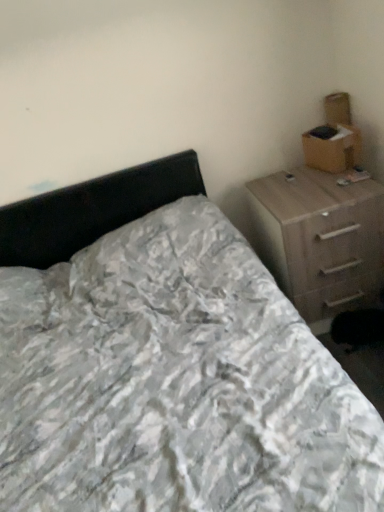
Question: Does white textured bed at center turn towards light brown wood chest of drawers at right?

Choices:
 (A) no
 (B) yes

Answer: (A)

Question: Can you confirm if white textured bed at center is thinner than light brown wood chest of drawers at right?

Choices:
 (A) no
 (B) yes

Answer: (A)

Question: Is white textured bed at center shorter than light brown wood chest of drawers at right?

Choices:
 (A) no
 (B) yes

Answer: (A)

Question: Considering the relative sizes of white textured bed at center and light brown wood chest of drawers at right in the image provided, is white textured bed at center smaller than light brown wood chest of drawers at right?

Choices:
 (A) no
 (B) yes

Answer: (A)

Question: Is light brown wood chest of drawers at right inside white textured bed at center?

Choices:
 (A) yes
 (B) no

Answer: (B)

Question: Would you say white textured bed at center is inside or outside brown cardboard box at upper right?

Choices:
 (A) outside
 (B) inside

Answer: (A)

Question: From the image's perspective, relative to brown cardboard box at upper right, is white textured bed at center above or below?

Choices:
 (A) above
 (B) below

Answer: (B)

Question: Considering the relative positions of white textured bed at center and brown cardboard box at upper right in the image provided, is white textured bed at center to the left or to the right of brown cardboard box at upper right?

Choices:
 (A) left
 (B) right

Answer: (A)

Question: From a real-world perspective, relative to brown cardboard box at upper right, is white textured bed at center vertically above or below?

Choices:
 (A) above
 (B) below

Answer: (B)

Question: From a real-world perspective, is white textured bed at center above or below light brown wood chest of drawers at right?

Choices:
 (A) above
 (B) below

Answer: (A)

Question: Visually, is white textured bed at center positioned to the left or to the right of light brown wood chest of drawers at right?

Choices:
 (A) left
 (B) right

Answer: (A)

Question: Based on their sizes in the image, would you say white textured bed at center is bigger or smaller than light brown wood chest of drawers at right?

Choices:
 (A) big
 (B) small

Answer: (A)

Question: From the image's perspective, is white textured bed at center located above or below light brown wood chest of drawers at right?

Choices:
 (A) above
 (B) below

Answer: (B)

Question: Based on their sizes in the image, would you say brown cardboard box at upper right is bigger or smaller than light brown wood chest of drawers at right?

Choices:
 (A) big
 (B) small

Answer: (B)

Question: From a real-world perspective, is brown cardboard box at upper right above or below light brown wood chest of drawers at right?

Choices:
 (A) below
 (B) above

Answer: (B)